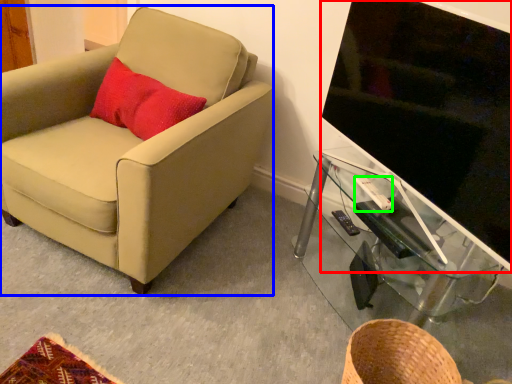
Question: Considering the real-world distances, which object is closest to television (highlighted by a red box)? chair (highlighted by a blue box) or remote control (highlighted by a green box).

Choices:
 (A) chair
 (B) remote control

Answer: (B)